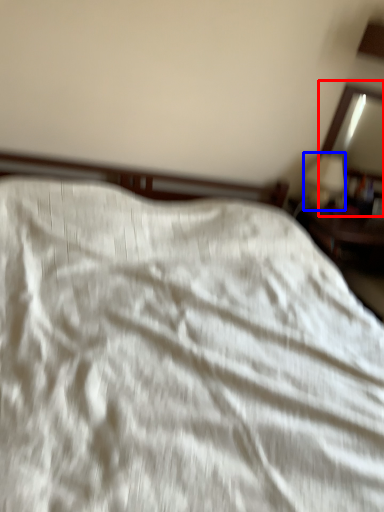
Question: Which object is further to the camera taking this photo, mirror (highlighted by a red box) or table lamp (highlighted by a blue box)?

Choices:
 (A) mirror
 (B) table lamp

Answer: (A)